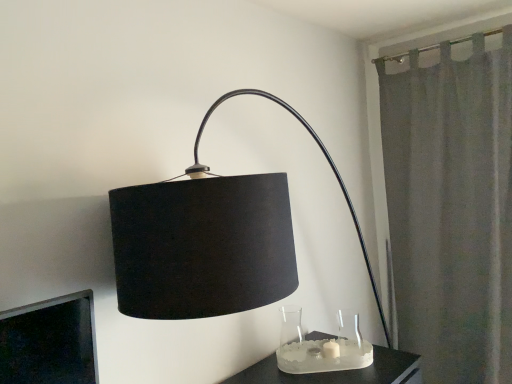
In order to face gray fabric curtain at right, should I rotate leftwards or rightwards?

Rotate right and turn 23.940 degrees.

Describe the element at coordinates (324, 355) in the screenshot. I see `satin glass candle holder at lower center` at that location.

Identify the location of clear glass vase at lower center, which is counted as the 1th glass vase, starting from the left. The image size is (512, 384). (291, 325).

Measure the distance between transparent glass vase at lower center, which is the 2th glass vase in left-to-right order, and camera.

A distance of 6.76 feet exists between transparent glass vase at lower center, which is the 2th glass vase in left-to-right order, and camera.

Identify the location of gray fabric curtain at right. (452, 208).

Is transparent glass vase at lower center, marked as the 1th glass vase in a right-to-left arrangement, thinner than clear glass vase at lower center, which is counted as the 1th glass vase, starting from the left?

Indeed, transparent glass vase at lower center, marked as the 1th glass vase in a right-to-left arrangement, has a lesser width compared to clear glass vase at lower center, which is counted as the 1th glass vase, starting from the left.

Does point (356, 321) come farther from viewer compared to point (284, 325)?

Yes, point (356, 321) is behind point (284, 325).

Considering the relative sizes of transparent glass vase at lower center, which is the 2th glass vase in left-to-right order, and clear glass vase at lower center, which is the second glass vase from right to left, in the image provided, is transparent glass vase at lower center, which is the 2th glass vase in left-to-right order, smaller than clear glass vase at lower center, which is the second glass vase from right to left,?

Correct, transparent glass vase at lower center, which is the 2th glass vase in left-to-right order, occupies less space than clear glass vase at lower center, which is the second glass vase from right to left.

In the image, is gray fabric curtain at right positioned in front of or behind satin glass candle holder at lower center?

gray fabric curtain at right is behind satin glass candle holder at lower center.

Which is more to the left, gray fabric curtain at right or satin glass candle holder at lower center?

satin glass candle holder at lower center.

Locate an element on the screen. candle holder in front of the gray fabric curtain at right is located at coordinates (324, 355).

Consider the image. Is gray fabric curtain at right shorter than satin glass candle holder at lower center?

No, gray fabric curtain at right is not shorter than satin glass candle holder at lower center.

Is clear glass vase at lower center, which is counted as the 1th glass vase, starting from the left, to the left or to the right of transparent glass vase at lower center, which is the 2th glass vase in left-to-right order, in the image?

In the image, clear glass vase at lower center, which is counted as the 1th glass vase, starting from the left, appears on the left side of transparent glass vase at lower center, which is the 2th glass vase in left-to-right order.

Is clear glass vase at lower center, which is counted as the 1th glass vase, starting from the left, oriented towards transparent glass vase at lower center, which is the 2th glass vase in left-to-right order?

No, clear glass vase at lower center, which is counted as the 1th glass vase, starting from the left, is not oriented towards transparent glass vase at lower center, which is the 2th glass vase in left-to-right order.

Is clear glass vase at lower center, which is the second glass vase from right to left, next to transparent glass vase at lower center, marked as the 1th glass vase in a right-to-left arrangement?

No, clear glass vase at lower center, which is the second glass vase from right to left, is not with transparent glass vase at lower center, marked as the 1th glass vase in a right-to-left arrangement.

Is clear glass vase at lower center, which is counted as the 1th glass vase, starting from the left, spatially inside transparent glass vase at lower center, marked as the 1th glass vase in a right-to-left arrangement, or outside of it?

clear glass vase at lower center, which is counted as the 1th glass vase, starting from the left, is not inside transparent glass vase at lower center, marked as the 1th glass vase in a right-to-left arrangement, it's outside.

Is clear glass vase at lower center, which is the second glass vase from right to left, facing away from satin glass candle holder at lower center?

No, clear glass vase at lower center, which is the second glass vase from right to left,'s orientation is not away from satin glass candle holder at lower center.

Measure the distance from clear glass vase at lower center, which is counted as the 1th glass vase, starting from the left, to satin glass candle holder at lower center.

6.80 inches.

Would you say clear glass vase at lower center, which is the second glass vase from right to left, contains satin glass candle holder at lower center?

No, satin glass candle holder at lower center is not inside clear glass vase at lower center, which is the second glass vase from right to left.

From the picture: Considering the relative sizes of clear glass vase at lower center, which is counted as the 1th glass vase, starting from the left, and gray fabric curtain at right in the image provided, is clear glass vase at lower center, which is counted as the 1th glass vase, starting from the left, shorter than gray fabric curtain at right?

Indeed, clear glass vase at lower center, which is counted as the 1th glass vase, starting from the left, has a lesser height compared to gray fabric curtain at right.

Could you tell me if clear glass vase at lower center, which is counted as the 1th glass vase, starting from the left, is turned towards gray fabric curtain at right?

No, clear glass vase at lower center, which is counted as the 1th glass vase, starting from the left, is not oriented towards gray fabric curtain at right.

Is clear glass vase at lower center, which is the second glass vase from right to left, closer to camera compared to gray fabric curtain at right?

Yes.

How much distance is there between clear glass vase at lower center, which is the second glass vase from right to left, and gray fabric curtain at right?

A distance of 38.49 inches exists between clear glass vase at lower center, which is the second glass vase from right to left, and gray fabric curtain at right.

From a real-world perspective, who is located lower, gray fabric curtain at right or clear glass vase at lower center, which is the second glass vase from right to left?

clear glass vase at lower center, which is the second glass vase from right to left.

From the image's perspective, relative to clear glass vase at lower center, which is counted as the 1th glass vase, starting from the left, is gray fabric curtain at right above or below?

gray fabric curtain at right is situated higher than clear glass vase at lower center, which is counted as the 1th glass vase, starting from the left, in the image.

Looking at this image, can you confirm if gray fabric curtain at right is bigger than clear glass vase at lower center, which is the second glass vase from right to left?

Yes.

Considering the relative positions of gray fabric curtain at right and clear glass vase at lower center, which is the second glass vase from right to left, in the image provided, is gray fabric curtain at right to the left or to the right of clear glass vase at lower center, which is the second glass vase from right to left,?

gray fabric curtain at right is to the right of clear glass vase at lower center, which is the second glass vase from right to left.

From the image's perspective, which one is positioned higher, satin glass candle holder at lower center or clear glass vase at lower center, which is counted as the 1th glass vase, starting from the left?

clear glass vase at lower center, which is counted as the 1th glass vase, starting from the left, appears higher in the image.

Which object is wider, satin glass candle holder at lower center or clear glass vase at lower center, which is the second glass vase from right to left?

satin glass candle holder at lower center is wider.

In the scene shown: Which is less distant, (295, 349) or (290, 335)?

Clearly, point (295, 349) is closer to the camera than point (290, 335).

Which is behind, satin glass candle holder at lower center or clear glass vase at lower center, which is counted as the 1th glass vase, starting from the left?

clear glass vase at lower center, which is counted as the 1th glass vase, starting from the left, is more distant.

The image size is (512, 384). In the image, there is a clear glass vase at lower center, which is the second glass vase from right to left. Identify the location of glass vase above it (from the image's perspective). coord(349,328).

Find the location of a particular element. curtain located above the satin glass candle holder at lower center (from a real-world perspective) is located at coordinates (452, 208).

From the image, which object appears to be farther from clear glass vase at lower center, which is counted as the 1th glass vase, starting from the left, gray fabric curtain at right or transparent glass vase at lower center, marked as the 1th glass vase in a right-to-left arrangement?

gray fabric curtain at right.

When comparing their distances from transparent glass vase at lower center, marked as the 1th glass vase in a right-to-left arrangement, does clear glass vase at lower center, which is counted as the 1th glass vase, starting from the left, or satin glass candle holder at lower center seem closer?

clear glass vase at lower center, which is counted as the 1th glass vase, starting from the left, is closer to transparent glass vase at lower center, marked as the 1th glass vase in a right-to-left arrangement.

Looking at this image, considering their positions, is satin glass candle holder at lower center positioned further to transparent glass vase at lower center, which is the 2th glass vase in left-to-right order, than clear glass vase at lower center, which is counted as the 1th glass vase, starting from the left?

satin glass candle holder at lower center is positioned further to the anchor transparent glass vase at lower center, which is the 2th glass vase in left-to-right order.

Which object lies nearer to the anchor point clear glass vase at lower center, which is counted as the 1th glass vase, starting from the left, transparent glass vase at lower center, which is the 2th glass vase in left-to-right order, or satin glass candle holder at lower center?

The object closer to clear glass vase at lower center, which is counted as the 1th glass vase, starting from the left, is satin glass candle holder at lower center.

Estimate the real-world distances between objects in this image. Which object is closer to clear glass vase at lower center, which is the second glass vase from right to left, transparent glass vase at lower center, marked as the 1th glass vase in a right-to-left arrangement, or gray fabric curtain at right?

Among the two, transparent glass vase at lower center, marked as the 1th glass vase in a right-to-left arrangement, is located nearer to clear glass vase at lower center, which is the second glass vase from right to left.

Which object lies nearer to the anchor point gray fabric curtain at right, clear glass vase at lower center, which is the second glass vase from right to left, or transparent glass vase at lower center, which is the 2th glass vase in left-to-right order?

The object closer to gray fabric curtain at right is transparent glass vase at lower center, which is the 2th glass vase in left-to-right order.

Considering their positions, is gray fabric curtain at right positioned further to transparent glass vase at lower center, marked as the 1th glass vase in a right-to-left arrangement, than clear glass vase at lower center, which is the second glass vase from right to left?

gray fabric curtain at right is further to transparent glass vase at lower center, marked as the 1th glass vase in a right-to-left arrangement.

From the image, which object appears to be nearer to satin glass candle holder at lower center, transparent glass vase at lower center, which is the 2th glass vase in left-to-right order, or gray fabric curtain at right?

transparent glass vase at lower center, which is the 2th glass vase in left-to-right order, is positioned closer to the anchor satin glass candle holder at lower center.

This screenshot has height=384, width=512. Identify the location of glass vase situated between satin glass candle holder at lower center and gray fabric curtain at right from left to right. (349, 328).

Where is `glass vase between clear glass vase at lower center, which is the second glass vase from right to left, and gray fabric curtain at right from left to right`? The width and height of the screenshot is (512, 384). glass vase between clear glass vase at lower center, which is the second glass vase from right to left, and gray fabric curtain at right from left to right is located at coordinates click(349, 328).

I want to click on candle holder between clear glass vase at lower center, which is counted as the 1th glass vase, starting from the left, and transparent glass vase at lower center, which is the 2th glass vase in left-to-right order, so click(x=324, y=355).

In order to click on candle holder between clear glass vase at lower center, which is the second glass vase from right to left, and gray fabric curtain at right in this screenshot , I will do `click(324, 355)`.